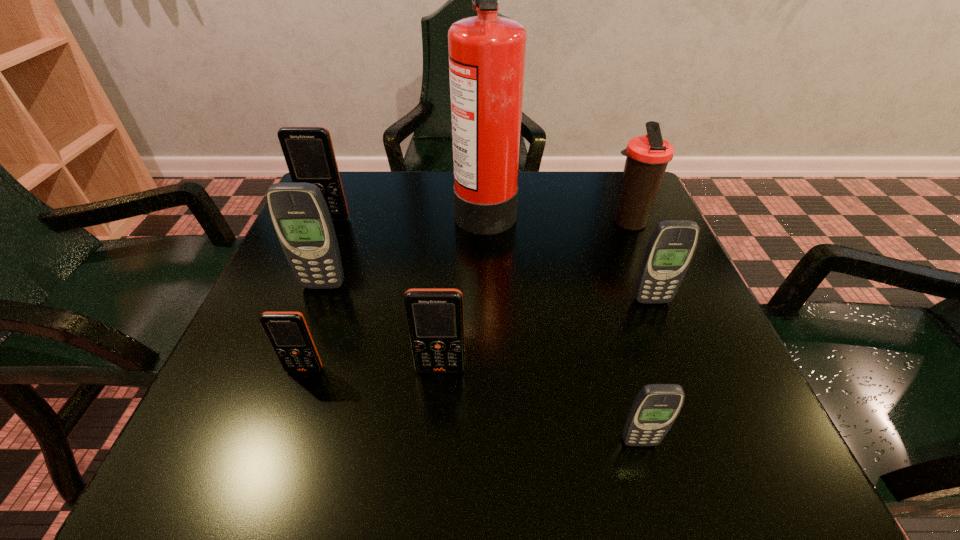
I want to click on vacant space situated on the screen of the fifth farthest object, so click(x=682, y=376).

Where is `free space located 0.140m on the screen of the rightmost orange cellular telephone`? free space located 0.140m on the screen of the rightmost orange cellular telephone is located at coordinates (434, 461).

The width and height of the screenshot is (960, 540). Find the location of `blank space located on the screen of the smallest orange cellular telephone`. blank space located on the screen of the smallest orange cellular telephone is located at coordinates (278, 445).

You are a GUI agent. You are given a task and a screenshot of the screen. Output one action in this format:
    pyautogui.click(x=<x>, y=<y>)
    Task: Click on the fire extinguisher at the far edge
    The height and width of the screenshot is (540, 960).
    Given the screenshot: What is the action you would take?
    pyautogui.click(x=487, y=52)

Where is `thermos bottle that is positioned at the far edge`? thermos bottle that is positioned at the far edge is located at coordinates (647, 158).

Where is `cellular telephone at the far edge`? The width and height of the screenshot is (960, 540). cellular telephone at the far edge is located at coordinates (308, 151).

Where is `object present at the near edge`? This screenshot has width=960, height=540. object present at the near edge is located at coordinates point(655,408).

Find the location of a particular element. thermos bottle present at the right edge is located at coordinates (647, 158).

I want to click on object that is at the far left corner, so click(308, 151).

Find the location of a particular element. This screenshot has width=960, height=540. object situated at the far right corner is located at coordinates (647, 158).